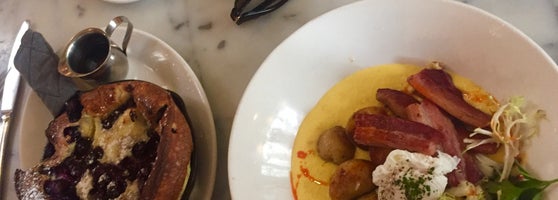
The height and width of the screenshot is (200, 558). I want to click on nasty looking cream table, so click(x=529, y=17).